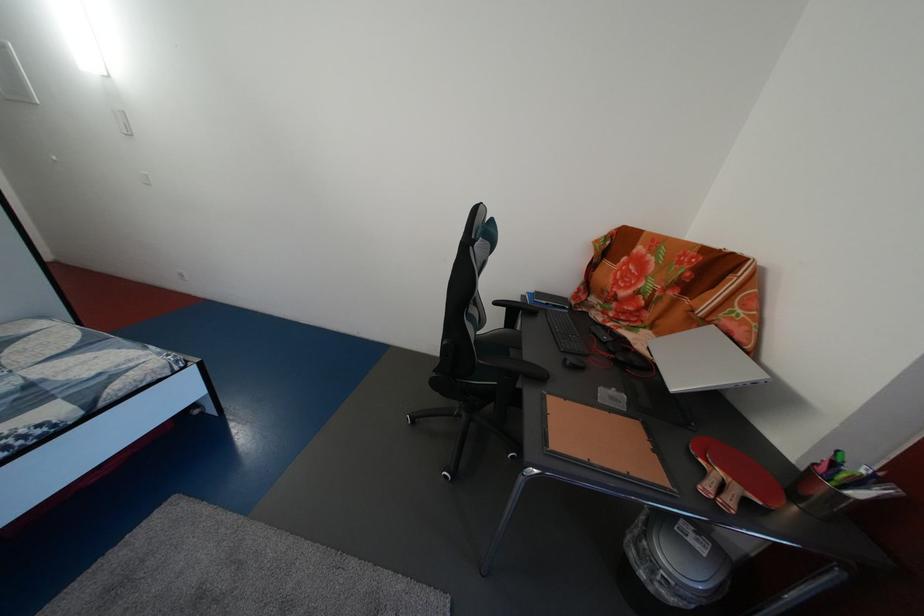
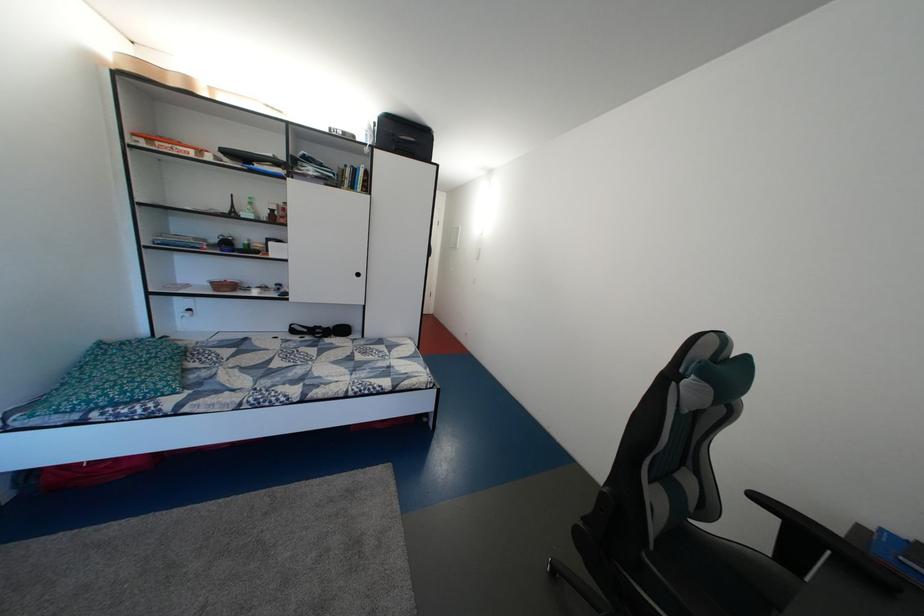
Question: The first image is from the beginning of the video and the second image is from the end. How did the camera likely rotate when shooting the video?

Choices:
 (A) Left
 (B) Right
 (C) Up
 (D) Down

Answer: (A)